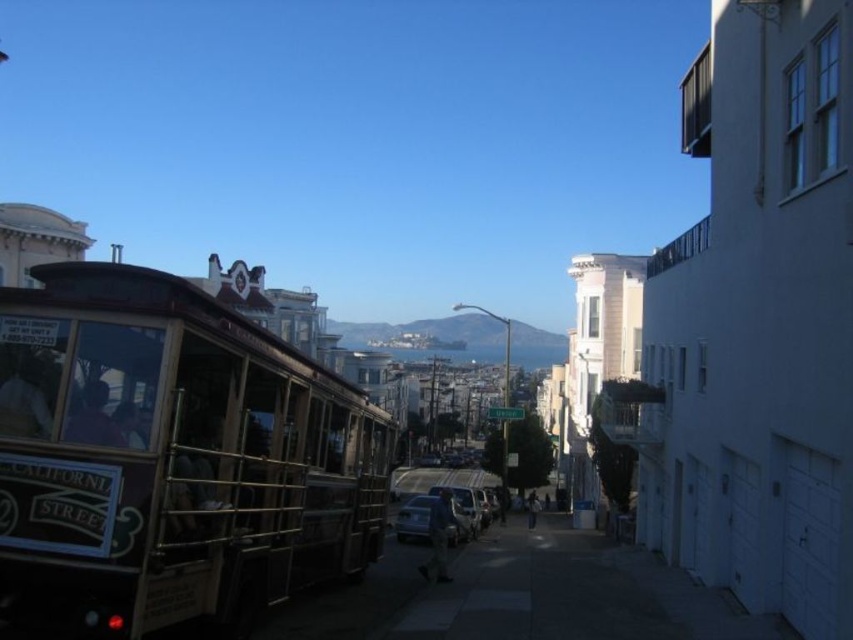
Question: Is wooden polished cable car at left thinner than satin silver sedan at center?

Choices:
 (A) yes
 (B) no

Answer: (A)

Question: Among these objects, which one is farthest from the camera?

Choices:
 (A) satin silver sedan at center
 (B) wooden polished cable car at left

Answer: (A)

Question: Is wooden polished cable car at left above satin silver sedan at center?

Choices:
 (A) no
 (B) yes

Answer: (B)

Question: Which point is farther from the camera taking this photo?

Choices:
 (A) click(398, 508)
 (B) click(318, 548)

Answer: (A)

Question: Is wooden polished cable car at left smaller than satin silver sedan at center?

Choices:
 (A) no
 (B) yes

Answer: (B)

Question: Which of the following is the closest to the observer?

Choices:
 (A) wooden polished cable car at left
 (B) satin silver sedan at center

Answer: (A)